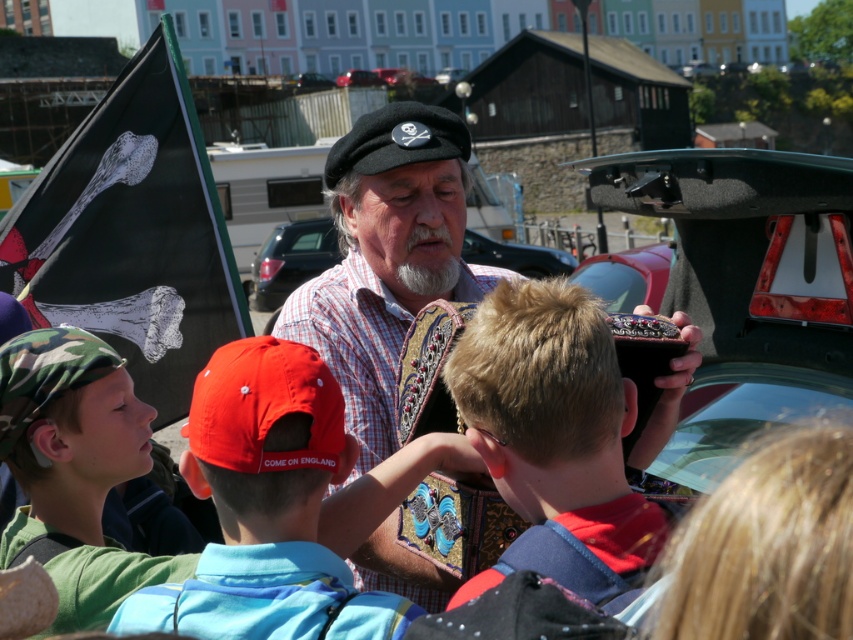
Based on the photo, you are a photographer trying to capture a clear photo of the red fabric cap at center and the metallic car trunk at center. Since both are in the center, will you need to adjust your camera angle to focus on one without the other blocking it?

The red fabric cap at center is in front of the metallic car trunk at center, so focusing on the red fabric cap at center would naturally hide the metallic car trunk at center behind it. To capture both clearly, you need to adjust your angle to ensure neither blocks the other.

You are a photographer standing at the camera position. You want to take a photo of the black fabric flag at left while also capturing the pirate and children in the foreground. Since the flag is 13.70 meters away, will you need to adjust your camera focus to ensure both the flag and the foreground subjects are in focus?

The black fabric flag at left is 13.70 meters from the camera. To ensure both the flag and the foreground subjects are in focus, you need to set the focus point somewhere between them, possibly using a smaller aperture for a deeper depth of field.

You are a photographer trying to capture a photo of the metallic car trunk at center without the black fabric flag at left appearing in the frame. Based on their positions, is this possible?

The black fabric flag at left is above the metallic car trunk at center, so it would block the view. To avoid capturing the flag, you need to adjust your angle or position lower to frame the car trunk without the flag in the shot.